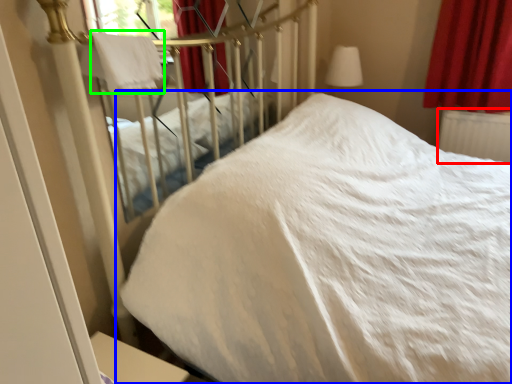
Question: Which object is positioned closest to radiator (highlighted by a red box)? Select from bed (highlighted by a blue box) and blanket (highlighted by a green box).

Choices:
 (A) bed
 (B) blanket

Answer: (A)